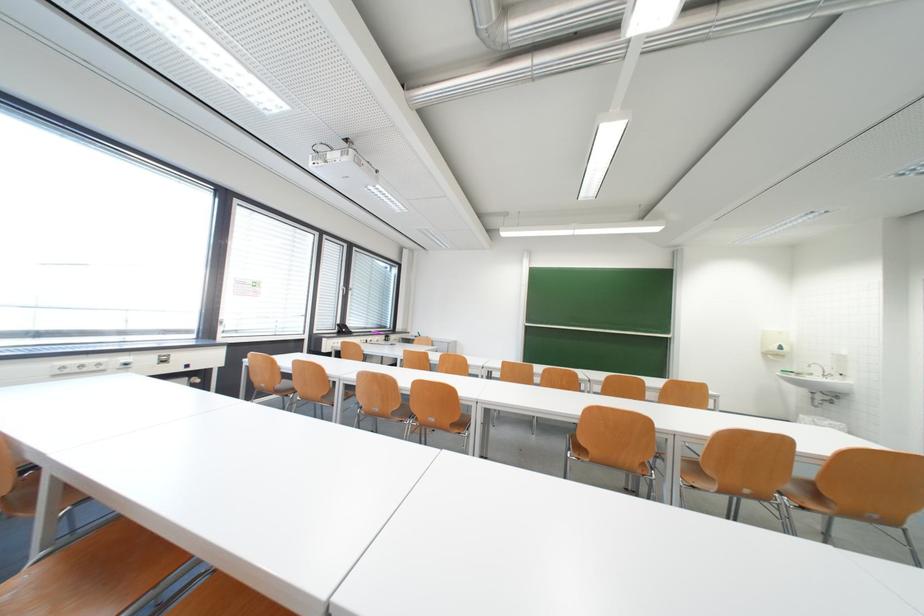
Find the location of a particular element. Image resolution: width=924 pixels, height=616 pixels. faucet handle is located at coordinates (816, 369).